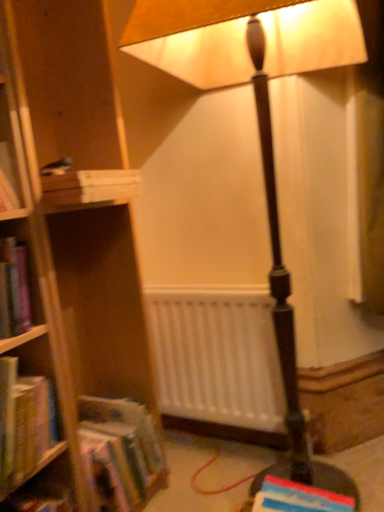
Question: From the image's perspective, is hardcover book at lower right, which is counted as the 1th book, starting from the bottom, above white matte radiator at center?

Choices:
 (A) no
 (B) yes

Answer: (A)

Question: Is hardcover book at lower right, the fourth book positioned from the top, wider than white matte radiator at center?

Choices:
 (A) yes
 (B) no

Answer: (A)

Question: Considering the relative sizes of hardcover book at lower right, which is counted as the 1th book, starting from the bottom, and white matte radiator at center in the image provided, is hardcover book at lower right, which is counted as the 1th book, starting from the bottom, smaller than white matte radiator at center?

Choices:
 (A) no
 (B) yes

Answer: (B)

Question: Can you confirm if hardcover book at lower right, which is counted as the 1th book, starting from the bottom, is shorter than white matte radiator at center?

Choices:
 (A) yes
 (B) no

Answer: (A)

Question: Can we say hardcover book at lower right, the fourth book positioned from the top, lies outside white matte radiator at center?

Choices:
 (A) no
 (B) yes

Answer: (B)

Question: Is hardcover book at lower right, the fourth book positioned from the top, touching white matte radiator at center?

Choices:
 (A) no
 (B) yes

Answer: (A)

Question: Considering the relative sizes of white matte radiator at center and hardcover book at lower right, which is counted as the 1th book, starting from the bottom, in the image provided, is white matte radiator at center bigger than hardcover book at lower right, which is counted as the 1th book, starting from the bottom,?

Choices:
 (A) no
 (B) yes

Answer: (B)

Question: Is white matte radiator at center shorter than hardcover book at lower right, the fourth book positioned from the top?

Choices:
 (A) no
 (B) yes

Answer: (A)

Question: From the image's perspective, is white matte radiator at center over hardcover book at lower right, which is counted as the 1th book, starting from the bottom?

Choices:
 (A) yes
 (B) no

Answer: (A)

Question: Is white matte radiator at center smaller than hardcover book at lower right, the fourth book positioned from the top?

Choices:
 (A) yes
 (B) no

Answer: (B)

Question: Does white matte radiator at center have a greater width compared to hardcover book at lower right, which is counted as the 1th book, starting from the bottom?

Choices:
 (A) no
 (B) yes

Answer: (A)

Question: Can you confirm if white matte radiator at center is taller than hardcover book at lower right, which is counted as the 1th book, starting from the bottom?

Choices:
 (A) yes
 (B) no

Answer: (A)

Question: Is hardcover book at left, the 3th book ordered from the bottom, thinner than matte brown lamp at center?

Choices:
 (A) yes
 (B) no

Answer: (A)